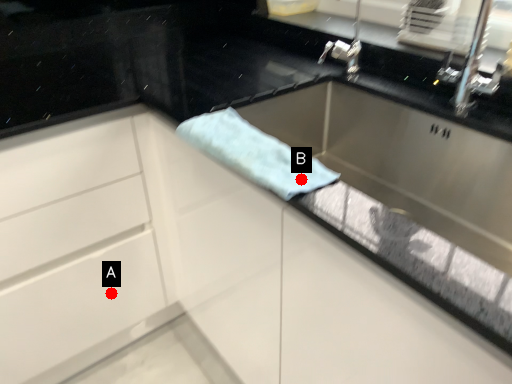
Question: Two points are circled on the image, labeled by A and B beside each circle. Among these points, which one is nearest to the camera?

Choices:
 (A) A is closer
 (B) B is closer

Answer: (B)